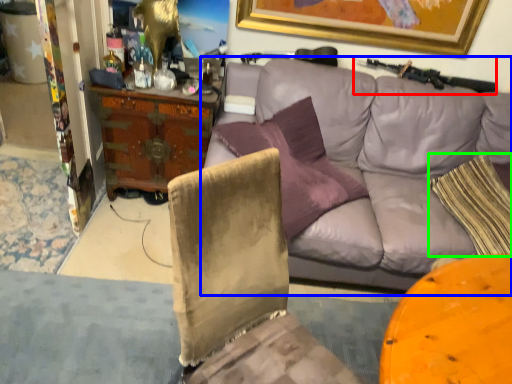
Question: Considering the real-world distances, which object is closest to shotgun (highlighted by a red box)? studio couch (highlighted by a blue box) or pillow (highlighted by a green box).

Choices:
 (A) studio couch
 (B) pillow

Answer: (A)